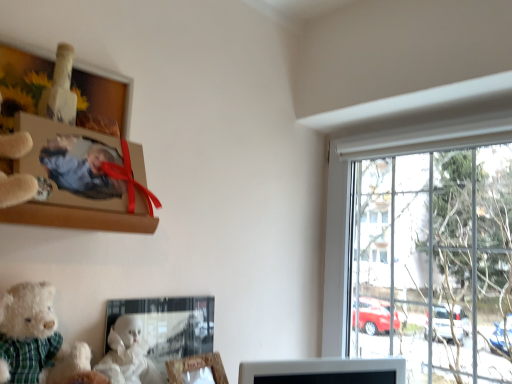
Question: Choose the correct answer: Is matte cardboard photo frame at upper left, positioned as the 1th picture frame in top-to-bottom order, inside wooden photo frame at upper left, the second picture frame when ordered from top to bottom, or outside it?

Choices:
 (A) outside
 (B) inside

Answer: (A)

Question: Relative to wooden photo frame at upper left, the second picture frame when ordered from top to bottom, is matte cardboard photo frame at upper left, the 4th picture frame from the bottom, in front or behind?

Choices:
 (A) front
 (B) behind

Answer: (B)

Question: Estimate the real-world distances between objects in this image. Which object is farther from the wooden photo frame at upper left, placed as the third picture frame when sorted from bottom to top?

Choices:
 (A) matte glass picture frame at lower center, placed as the 3th picture frame when sorted from top to bottom
 (B) matte cardboard photo frame at upper left, the 4th picture frame from the bottom
 (C) white fluffy teddy bear at lower left
 (D) wooden picture frame at lower center, which is the 4th picture frame in top-to-bottom order

Answer: (D)

Question: Estimate the real-world distances between objects in this image. Which object is closer to the matte glass picture frame at lower center, placed as the 3th picture frame when sorted from top to bottom?

Choices:
 (A) wooden picture frame at lower center, arranged as the 1th picture frame when ordered from the bottom
 (B) wooden photo frame at upper left, placed as the third picture frame when sorted from bottom to top
 (C) white fluffy teddy bear at lower left
 (D) matte cardboard photo frame at upper left, the 4th picture frame from the bottom

Answer: (A)